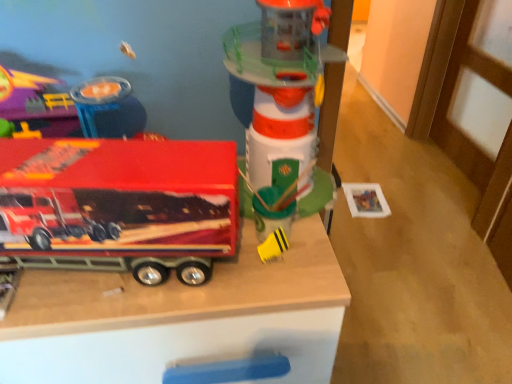
Question: From a real-world perspective, is shiny red truck at left, the first toy positioned from the left, above or below yellow rubber duck at center, which is counted as the 2th toy, starting from the right?

Choices:
 (A) below
 (B) above

Answer: (B)

Question: In the image, is shiny red truck at left, the first toy positioned from the left, positioned in front of or behind yellow rubber duck at center, which is counted as the 2th toy, starting from the right?

Choices:
 (A) front
 (B) behind

Answer: (A)

Question: Considering the real-world distances, which object is farthest from the shiny red truck at left, positioned as the fourth toy in right-to-left order?

Choices:
 (A) metallic red truck at left, the second toy from the left
 (B) yellow rubber duck at center, the 3th toy viewed from the left
 (C) translucent plastic lighthouse at center, the 4th toy viewed from the left
 (D) wooden toy truck at center

Answer: (B)

Question: Based on their relative distances, which object is nearer to the wooden toy truck at center?

Choices:
 (A) translucent plastic lighthouse at center, the first toy when ordered from right to left
 (B) yellow rubber duck at center, the 3th toy viewed from the left
 (C) metallic red truck at left, the third toy positioned from the right
 (D) shiny red truck at left, positioned as the fourth toy in right-to-left order

Answer: (C)